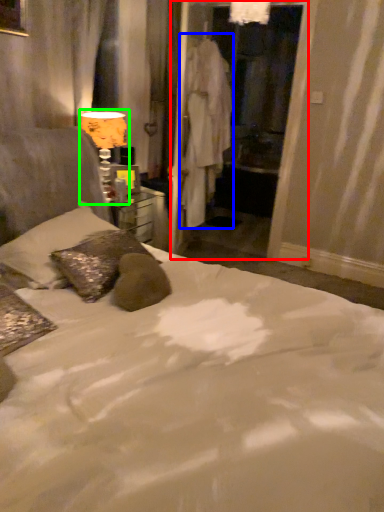
Question: Which object is positioned closest to screen door (highlighted by a red box)? Select from robe (highlighted by a blue box) and table lamp (highlighted by a green box).

Choices:
 (A) robe
 (B) table lamp

Answer: (A)